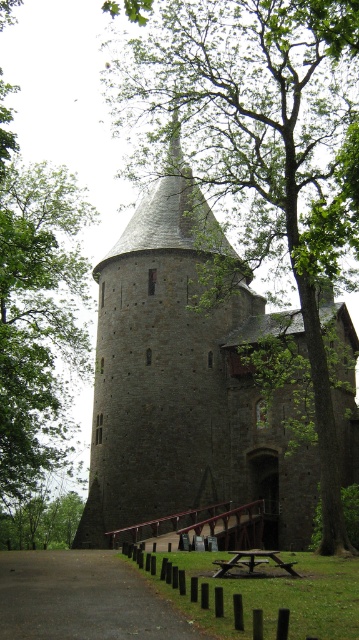
Question: Which object is farther from the camera taking this photo?

Choices:
 (A) wooden picnic table at lower center
 (B) green leafy tree at lower left
 (C) dark gray stone tower at center

Answer: (B)

Question: Which point is closer to the camera taking this photo?

Choices:
 (A) (244, 420)
 (B) (19, 516)

Answer: (A)

Question: Can you confirm if green leafy tree at left is bigger than dark asphalt path at lower center?

Choices:
 (A) yes
 (B) no

Answer: (A)

Question: Which object is farther from the camera taking this photo?

Choices:
 (A) wooden picnic table at lower center
 (B) dark asphalt path at lower center

Answer: (A)

Question: In this image, where is green leafy tree at left located relative to dark asphalt path at lower center?

Choices:
 (A) right
 (B) left

Answer: (B)

Question: Can you confirm if green leafy tree at left is positioned to the left of wooden picnic table at lower center?

Choices:
 (A) yes
 (B) no

Answer: (A)